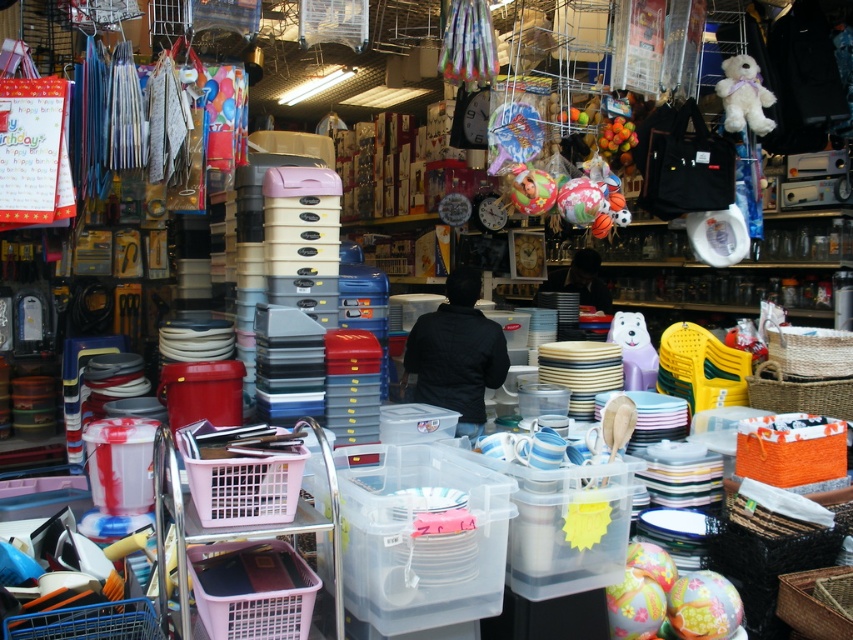
Question: Which point is closer to the camera?

Choices:
 (A) (625, 326)
 (B) (456, 305)

Answer: (A)

Question: Which of the following is the closest to the observer?

Choices:
 (A) (525, 173)
 (B) (732, 104)

Answer: (A)

Question: Where is black matte jacket at center located in relation to matte green ball at center in the image?

Choices:
 (A) below
 (B) above

Answer: (A)

Question: Does white plush bear at upper right have a greater width compared to purple plastic bear at center?

Choices:
 (A) no
 (B) yes

Answer: (B)

Question: Where is black matte jacket at center located in relation to purple plastic bear at center in the image?

Choices:
 (A) right
 (B) left

Answer: (B)

Question: Estimate the real-world distances between objects in this image. Which object is farther from the purple plastic bear at center?

Choices:
 (A) black matte jacket at center
 (B) matte green ball at center
 (C) white plush bear at upper right

Answer: (C)